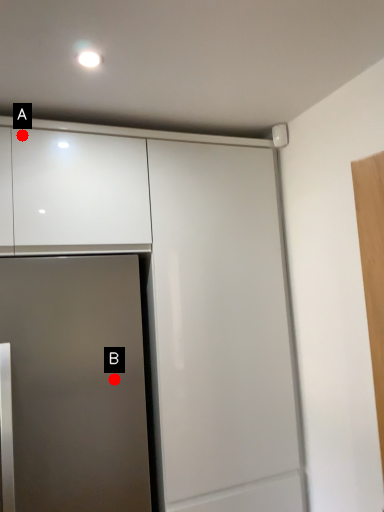
Question: Two points are circled on the image, labeled by A and B beside each circle. Which of the following is the farthest from the observer?

Choices:
 (A) A is further
 (B) B is further

Answer: (B)